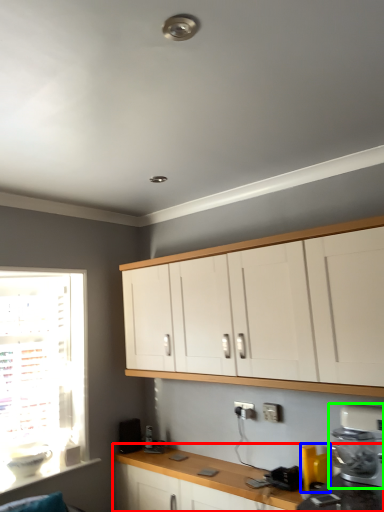
Question: Which object is the farthest from countertop (highlighted by a red box)? Choose among these: appliance (highlighted by a blue box) or kitchen appliance (highlighted by a green box).

Choices:
 (A) appliance
 (B) kitchen appliance

Answer: (B)